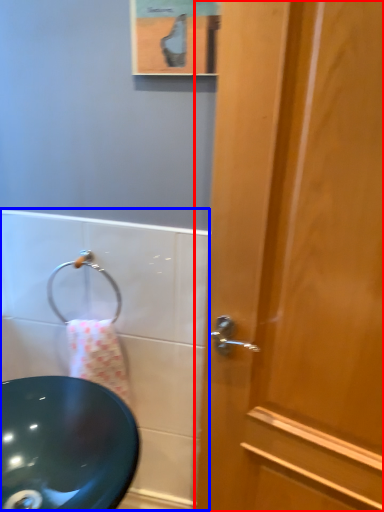
Question: Which point is closer to the camera, door (highlighted by a red box) or bath (highlighted by a blue box)?

Choices:
 (A) door
 (B) bath

Answer: (A)